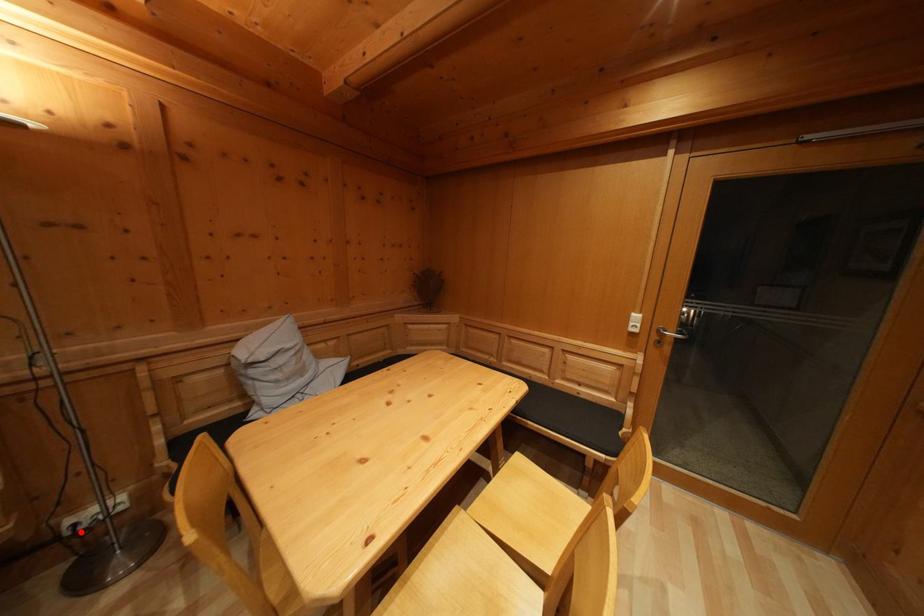
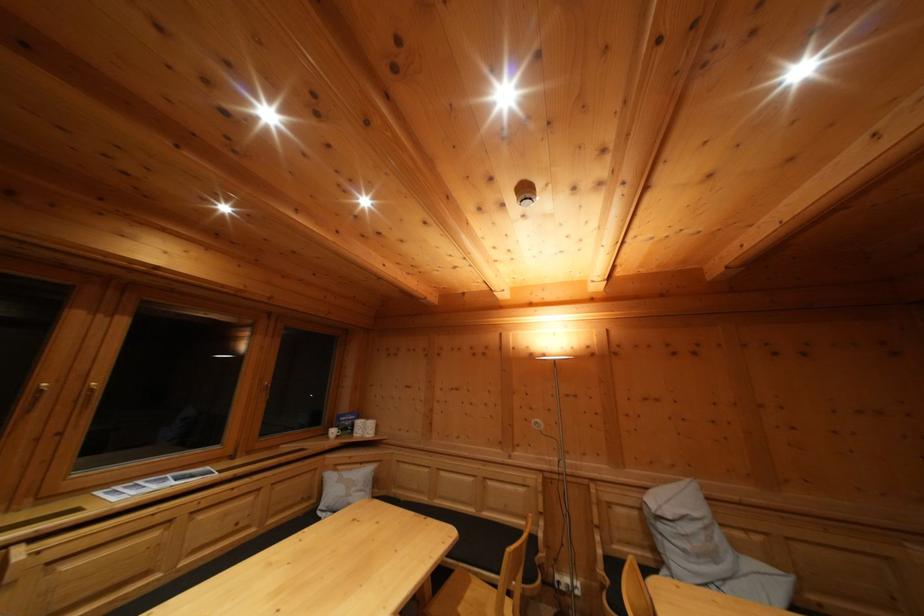
The point at the highlighted location is marked in the first image. Where is the corresponding point in the second image?

(565, 590)